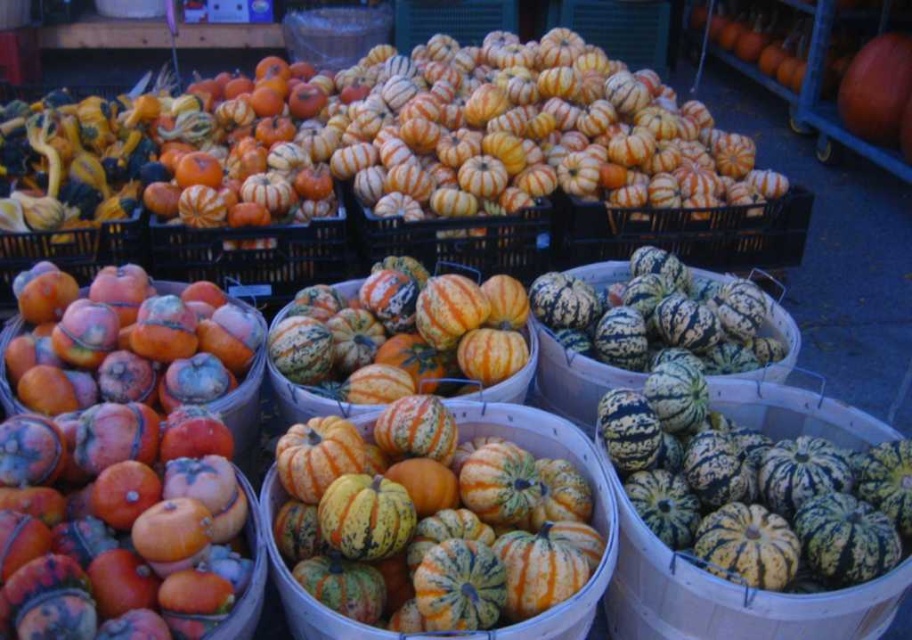
You are setting up a display for a fall festival and need to know which pumpkin or gourd is shorter to place it at the front for visibility. Which one is shorter between the green speckled squash at center and the speckled orange gourd at center?

The green speckled squash at center is not as tall as the speckled orange gourd at center, so the green speckled squash at center is shorter and should be placed at the front for better visibility.

You are setting up a display for a fall festival and have two items at the center of the arrangement. You need to know which one is wider to ensure proper spacing. Which is wider between the green speckled squash at center and the green striped gourd at center?

The green striped gourd at center is wider than the green speckled squash at center.